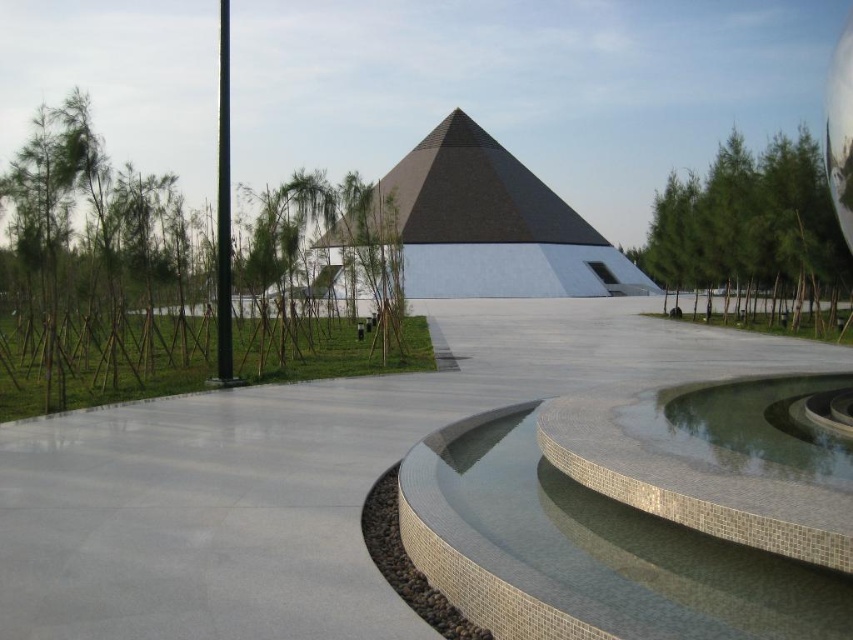
Does gray polished concrete at center have a lesser height compared to gray mosaic water at center?

Incorrect, gray polished concrete at center's height does not fall short of gray mosaic water at center's.

Which is in front, point (149, 406) or point (827, 572)?

Point (827, 572) is more forward.

Identify the location of gray polished concrete at center. (294, 476).

Consider the image. Who is taller, gray mosaic water at center or green leafy tree at upper right?

green leafy tree at upper right is taller.

Consider the image. Who is more distant from viewer, [525,492] or [724,214]?

Point [724,214]

Locate an element on the screen. gray mosaic water at center is located at coordinates (641, 515).

Between green leafy trees at left and green leafy tree at upper right, which one has more height?

Standing taller between the two is green leafy tree at upper right.

Looking at this image, can you confirm if green leafy trees at left is thinner than green leafy tree at upper right?

Yes, green leafy trees at left is thinner than green leafy tree at upper right.

Between point (126, 259) and point (680, 179), which one is positioned behind?

The point (680, 179) is more distant.

In order to click on green leafy trees at left in this screenshot , I will do tap(99, 276).